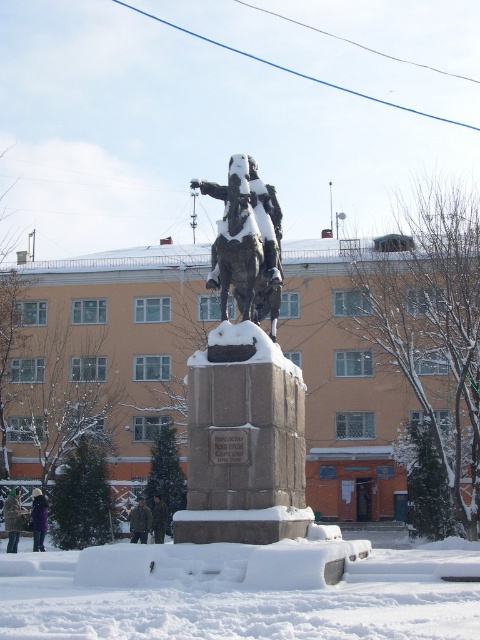
You are a photographer trying to capture both the bronze statue at center and the camouflage uniform at center in a single frame. Based on their positions, which object should you adjust your camera angle to focus on first to ensure both are in the shot?

The bronze statue at center is positioned on the right side of camouflage uniform at center. To capture both in a single frame, you should first focus on the bronze statue at center on the right and then adjust the angle to include the camouflage uniform at center on the left.

You are standing in the winter scene and see the dark green fur coat at lower left and the purple fuzzy jacket at lower left. Which one is closer to the ground?

The dark green fur coat at lower left is closer to the ground because it is positioned under the purple fuzzy jacket at lower left.